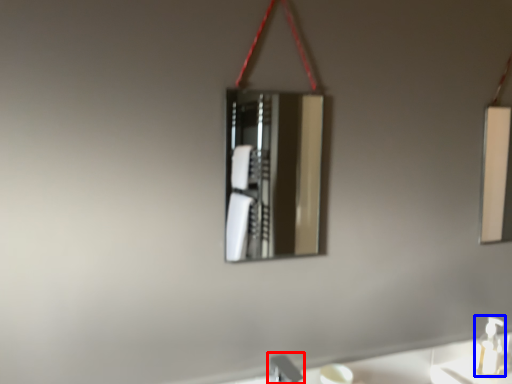
Question: Which of the following is the farthest to the observer, faucet (highlighted by a red box) or soap dispenser (highlighted by a blue box)?

Choices:
 (A) faucet
 (B) soap dispenser

Answer: (B)